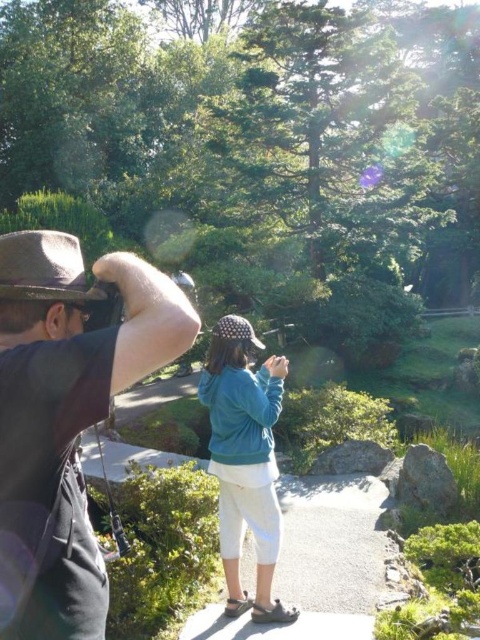
You are standing in the garden and want to take a photo of both the point at coordinates [256,500] and the point at coordinates [58,289]. Which point should you focus on first to ensure both are in focus?

You should focus on the point at coordinates [58,289] first because it is closer to you than the point at coordinates [256,500], which is further away. This way, both points will be within the depth of field.

From the picture: You are a photographer trying to frame a shot that includes both the brown fabric hat at upper left and the teal fleece jacket at center. Which object should you adjust your camera angle to prioritize if you want to ensure both are fully visible in the frame?

The brown fabric hat at upper left has a lesser height compared to teal fleece jacket at center, so you should prioritize adjusting your camera angle to accommodate the taller teal fleece jacket at center to ensure both are fully visible.

You are a photographer in the park and you notice the brown fabric hat at upper left and the teal fleece jacket at center. Which object is closer to you, the photographer?

The brown fabric hat at upper left is closer to you because it is in front of the teal fleece jacket at center.